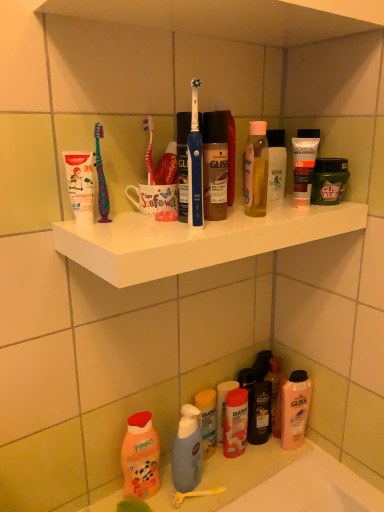
In order to click on white matte shelf at upper center in this screenshot , I will do `click(196, 239)`.

Measure the distance between point (157,455) and camera.

A distance of 38.90 inches exists between point (157,455) and camera.

Image resolution: width=384 pixels, height=512 pixels. I want to click on translucent plastic pump bottle at lower center, acting as the second toiletry starting from the left, so click(208, 420).

Locate an element on the screen. This screenshot has height=512, width=384. white matte toothpaste tube at upper left, acting as the 1th toiletry starting from the left is located at coordinates (80, 184).

Where is `matte orange lotion at lower center, the second toiletry in the bottom-to-top sequence`? This screenshot has width=384, height=512. matte orange lotion at lower center, the second toiletry in the bottom-to-top sequence is located at coordinates (235, 423).

What are the coordinates of `white matte shelf at upper center` in the screenshot? It's located at (196, 239).

Is white matte shelf at upper center next to pink matte shampoo at lower right, acting as the 2th cleaning product starting from the left, and touching it?

white matte shelf at upper center and pink matte shampoo at lower right, acting as the 2th cleaning product starting from the left, are clearly separated.

In order to click on shelf above the pink matte shampoo at lower right, acting as the 2th cleaning product starting from the left (from the image's perspective) in this screenshot , I will do `click(196, 239)`.

Is the depth of white matte shelf at upper center greater than that of pink matte shampoo at lower right, acting as the 2th cleaning product starting from the left?

No, the depth of white matte shelf at upper center is less than that of pink matte shampoo at lower right, acting as the 2th cleaning product starting from the left.

What's the angular difference between white matte shelf at upper center and pink matte shampoo at lower right, which ranks as the 2th cleaning product in front-to-back order,'s facing directions?

The angular difference between white matte shelf at upper center and pink matte shampoo at lower right, which ranks as the 2th cleaning product in front-to-back order, is 7.39e-05 degrees.

Is green matte hair mask at upper right, acting as the first toiletry starting from the right, far away from matte orange lotion at lower center, which is the fifth toiletry from top to bottom?

green matte hair mask at upper right, acting as the first toiletry starting from the right, is actually quite close to matte orange lotion at lower center, which is the fifth toiletry from top to bottom.

From the picture: How different are the orientations of green matte hair mask at upper right, marked as the 6th toiletry in a left-to-right arrangement, and matte orange lotion at lower center, which is the 3th toiletry in right-to-left order, in degrees?

1.38 degrees.

Which of these two, green matte hair mask at upper right, marked as the 6th toiletry in a left-to-right arrangement, or matte orange lotion at lower center, the second toiletry in the bottom-to-top sequence, is bigger?

matte orange lotion at lower center, the second toiletry in the bottom-to-top sequence.

From the matte orange lotion at lower center, which is the 3th toiletry in right-to-left order, count 2nd toiletry to the right and point to it. Please provide its 2D coordinates.

[(329, 181)]

Based on the photo, which object is positioned more to the right, green matte hair mask at upper right, marked as the 6th toiletry in a left-to-right arrangement, or white matte toothpaste tube at upper left, which is counted as the fourth toiletry, starting from the bottom?

Positioned to the right is green matte hair mask at upper right, marked as the 6th toiletry in a left-to-right arrangement.

Starting from the green matte hair mask at upper right, acting as the first toiletry starting from the right, which toiletry is the 2nd one in front? Please provide its 2D coordinates.

[(80, 184)]

From the image's perspective, is green matte hair mask at upper right, marked as the 6th toiletry in a left-to-right arrangement, under white matte toothpaste tube at upper left, positioned as the third toiletry in top-to-bottom order?

No, from the image's perspective, green matte hair mask at upper right, marked as the 6th toiletry in a left-to-right arrangement, is not beneath white matte toothpaste tube at upper left, positioned as the third toiletry in top-to-bottom order.

Considering the sizes of objects translucent plastic bottle at lower center, which appears as the 4th toiletry when viewed from the top, and translucent plastic bottles at lower center in the image provided, who is taller, translucent plastic bottle at lower center, which appears as the 4th toiletry when viewed from the top, or translucent plastic bottles at lower center?

translucent plastic bottle at lower center, which appears as the 4th toiletry when viewed from the top, is taller.

Is there a large distance between translucent plastic bottle at lower center, the 3th toiletry when ordered from bottom to top, and translucent plastic bottles at lower center?

No, translucent plastic bottle at lower center, the 3th toiletry when ordered from bottom to top, is in close proximity to translucent plastic bottles at lower center.

Consider the image. Which is closer, (236, 381) or (229, 484)?

The point (229, 484) is in front.

From the picture: From a real-world perspective, between translucent plastic bottle at lower center, the third toiletry from the left, and translucent plastic bottles at lower center, who is vertically lower?

In real-world perspective, translucent plastic bottles at lower center is lower.

From a real-world perspective, who is located higher, white matte toothpaste tube at upper left, positioned as the third toiletry in top-to-bottom order, or green matte hair mask at upper right, which appears as the 2th toiletry when viewed from the top?

In real-world perspective, white matte toothpaste tube at upper left, positioned as the third toiletry in top-to-bottom order, is above.

Can you confirm if white matte toothpaste tube at upper left, acting as the 1th toiletry starting from the left, is bigger than green matte hair mask at upper right, which is the 5th toiletry from bottom to top?

Actually, white matte toothpaste tube at upper left, acting as the 1th toiletry starting from the left, might be smaller than green matte hair mask at upper right, which is the 5th toiletry from bottom to top.

Consider the image. Is the surface of white matte toothpaste tube at upper left, acting as the 1th toiletry starting from the left, in direct contact with green matte hair mask at upper right, marked as the 6th toiletry in a left-to-right arrangement?

No, white matte toothpaste tube at upper left, acting as the 1th toiletry starting from the left, is not in contact with green matte hair mask at upper right, marked as the 6th toiletry in a left-to-right arrangement.

How many degrees apart are the facing directions of white matte toothpaste tube at upper left, the 6th toiletry from the right, and green matte hair mask at upper right, which appears as the 2th toiletry when viewed from the top?

The angular difference between white matte toothpaste tube at upper left, the 6th toiletry from the right, and green matte hair mask at upper right, which appears as the 2th toiletry when viewed from the top, is 2.09 degrees.

In the image, is translucent plastic bottle at lower center, which is the 4th toiletry from right to left, on the left side or the right side of matte orange lotion at lower center, which is the fifth toiletry from top to bottom?

translucent plastic bottle at lower center, which is the 4th toiletry from right to left, is to the left of matte orange lotion at lower center, which is the fifth toiletry from top to bottom.

From a real-world perspective, which is physically above, translucent plastic bottle at lower center, which appears as the 4th toiletry when viewed from the top, or matte orange lotion at lower center, the second toiletry in the bottom-to-top sequence?

From a 3D spatial view, matte orange lotion at lower center, the second toiletry in the bottom-to-top sequence, is above.

Is translucent plastic bottle at lower center, the 3th toiletry when ordered from bottom to top, bigger than matte orange lotion at lower center, which is the fourth toiletry from left to right?

Incorrect, translucent plastic bottle at lower center, the 3th toiletry when ordered from bottom to top, is not larger than matte orange lotion at lower center, which is the fourth toiletry from left to right.

Does translucent plastic bottle at lower center, the 3th toiletry when ordered from bottom to top, lie in front of matte orange lotion at lower center, which is the 3th toiletry in right-to-left order?

No, it is behind matte orange lotion at lower center, which is the 3th toiletry in right-to-left order.

Considering the relative sizes of translucent plastic pump bottle at lower center, the 1th toiletry when ordered from bottom to top, and pink matte bottle at lower left, marked as the 1th cleaning product in a left-to-right arrangement, in the image provided, is translucent plastic pump bottle at lower center, the 1th toiletry when ordered from bottom to top, shorter than pink matte bottle at lower left, marked as the 1th cleaning product in a left-to-right arrangement,?

Yes.

Which is more to the right, translucent plastic pump bottle at lower center, which is counted as the 6th toiletry, starting from the top, or pink matte bottle at lower left, the second cleaning product positioned from the right?

translucent plastic pump bottle at lower center, which is counted as the 6th toiletry, starting from the top.

From the picture: From a real-world perspective, is translucent plastic pump bottle at lower center, which is counted as the 6th toiletry, starting from the top, above or below pink matte bottle at lower left, the second cleaning product viewed from the back?

translucent plastic pump bottle at lower center, which is counted as the 6th toiletry, starting from the top, is below pink matte bottle at lower left, the second cleaning product viewed from the back.

How many degrees apart are the facing directions of translucent plastic pump bottle at lower center, acting as the fifth toiletry starting from the right, and pink matte bottle at lower left, the second cleaning product positioned from the right?

9.27e-05 degrees.

Where is `shelf that appears in front of the pink matte shampoo at lower right, acting as the 2th cleaning product starting from the left`? Image resolution: width=384 pixels, height=512 pixels. shelf that appears in front of the pink matte shampoo at lower right, acting as the 2th cleaning product starting from the left is located at coordinates (196, 239).

From a real-world perspective, which toiletry is the 1st one above the matte orange lotion at lower center, the second toiletry in the bottom-to-top sequence? Please provide its 2D coordinates.

[(329, 181)]

Looking at the image, which one is located closer to matte black tube at upper right, which ranks as the second toiletry in right-to-left order, translucent plastic pump bottle at lower center, the 1th toiletry when ordered from bottom to top, or translucent plastic bottle at lower center, which appears as the 4th toiletry when viewed from the top?

The object closer to matte black tube at upper right, which ranks as the second toiletry in right-to-left order, is translucent plastic bottle at lower center, which appears as the 4th toiletry when viewed from the top.

Based on their spatial positions, is white matte toothpaste tube at upper left, the 6th toiletry from the right, or matte orange lotion at lower center, which is the 3th toiletry in right-to-left order, closer to translucent plastic bottle at lower center, which is the 4th toiletry from right to left?

The object closer to translucent plastic bottle at lower center, which is the 4th toiletry from right to left, is matte orange lotion at lower center, which is the 3th toiletry in right-to-left order.

Which object lies further to the anchor point translucent plastic pump bottle at lower center, acting as the second toiletry starting from the left, matte orange lotion at lower center, which is the fourth toiletry from left to right, or translucent plastic bottles at lower center?

translucent plastic bottles at lower center lies further to translucent plastic pump bottle at lower center, acting as the second toiletry starting from the left, than the other object.

From the image, which object appears to be farther from white matte toothpaste tube at upper left, positioned as the third toiletry in top-to-bottom order, matte black tube at upper right, acting as the 1th toiletry starting from the top, or green matte hair mask at upper right, which appears as the 2th toiletry when viewed from the top?

Among the two, green matte hair mask at upper right, which appears as the 2th toiletry when viewed from the top, is located further to white matte toothpaste tube at upper left, positioned as the third toiletry in top-to-bottom order.

From the image, which object appears to be farther from pink matte shampoo at lower right, acting as the 2th cleaning product starting from the left, white matte toothpaste tube at upper left, positioned as the third toiletry in top-to-bottom order, or matte black tube at upper right, the fifth toiletry in the left-to-right sequence?

white matte toothpaste tube at upper left, positioned as the third toiletry in top-to-bottom order, is positioned further to the anchor pink matte shampoo at lower right, acting as the 2th cleaning product starting from the left.

Looking at the image, which one is located further to pink matte shampoo at lower right, the first cleaning product viewed from the right, white matte toothpaste tube at upper left, which is counted as the fourth toiletry, starting from the bottom, or matte orange lotion at lower center, which is the fifth toiletry from top to bottom?

Among the two, white matte toothpaste tube at upper left, which is counted as the fourth toiletry, starting from the bottom, is located further to pink matte shampoo at lower right, the first cleaning product viewed from the right.

In the scene shown: From the image, which object appears to be farther from pink matte bottle at lower left, the second cleaning product positioned from the right, matte black tube at upper right, the fifth toiletry in the left-to-right sequence, or white matte shelf at upper center?

matte black tube at upper right, the fifth toiletry in the left-to-right sequence, lies further to pink matte bottle at lower left, the second cleaning product positioned from the right, than the other object.

Looking at the image, which one is located further to matte orange lotion at lower center, which is the fifth toiletry from top to bottom, matte black tube at upper right, which ranks as the second toiletry in right-to-left order, or white matte toothpaste tube at upper left, acting as the 1th toiletry starting from the left?

white matte toothpaste tube at upper left, acting as the 1th toiletry starting from the left, is further to matte orange lotion at lower center, which is the fifth toiletry from top to bottom.

The height and width of the screenshot is (512, 384). Find the location of `cleaning product between white matte toothpaste tube at upper left, which is counted as the fourth toiletry, starting from the bottom, and translucent plastic bottle at lower center, which appears as the 4th toiletry when viewed from the top, in the up-down direction`. cleaning product between white matte toothpaste tube at upper left, which is counted as the fourth toiletry, starting from the bottom, and translucent plastic bottle at lower center, which appears as the 4th toiletry when viewed from the top, in the up-down direction is located at coordinates (295, 409).

Find the location of a particular element. Image resolution: width=384 pixels, height=512 pixels. shelf between blue plastic toothbrush at center and translucent plastic pump bottle at lower center, acting as the fifth toiletry starting from the right, from top to bottom is located at coordinates (196, 239).

The height and width of the screenshot is (512, 384). I want to click on shelf between green matte hair mask at upper right, acting as the first toiletry starting from the right, and translucent plastic pump bottle at lower center, the 1th toiletry when ordered from bottom to top, vertically, so click(x=196, y=239).

The image size is (384, 512). In order to click on toothbrush between green matte hair mask at upper right, which is the 5th toiletry from bottom to top, and translucent plastic pump bottle at lower center, the 1th toiletry when ordered from bottom to top, in the up-down direction in this screenshot , I will do `click(195, 165)`.